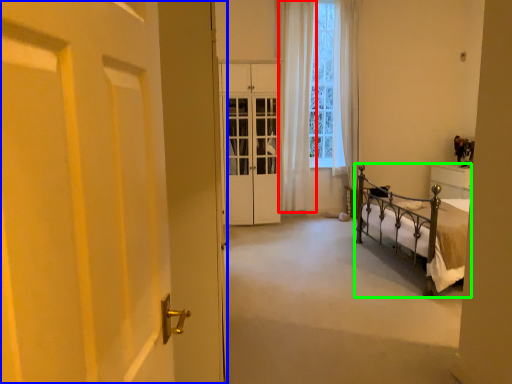
Question: Which object is the farthest from curtain (highlighted by a red box)? Choose among these: door (highlighted by a blue box) or bed (highlighted by a green box).

Choices:
 (A) door
 (B) bed

Answer: (A)